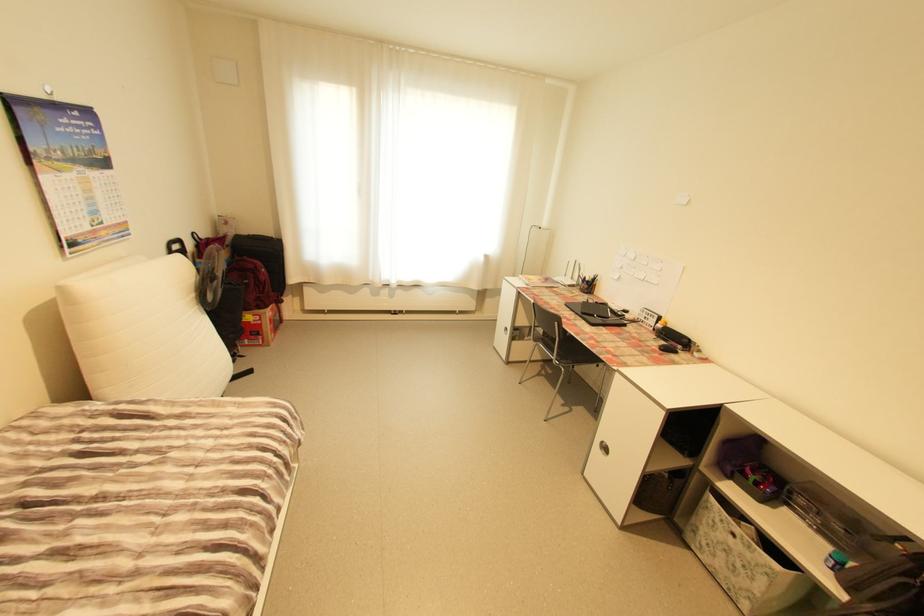
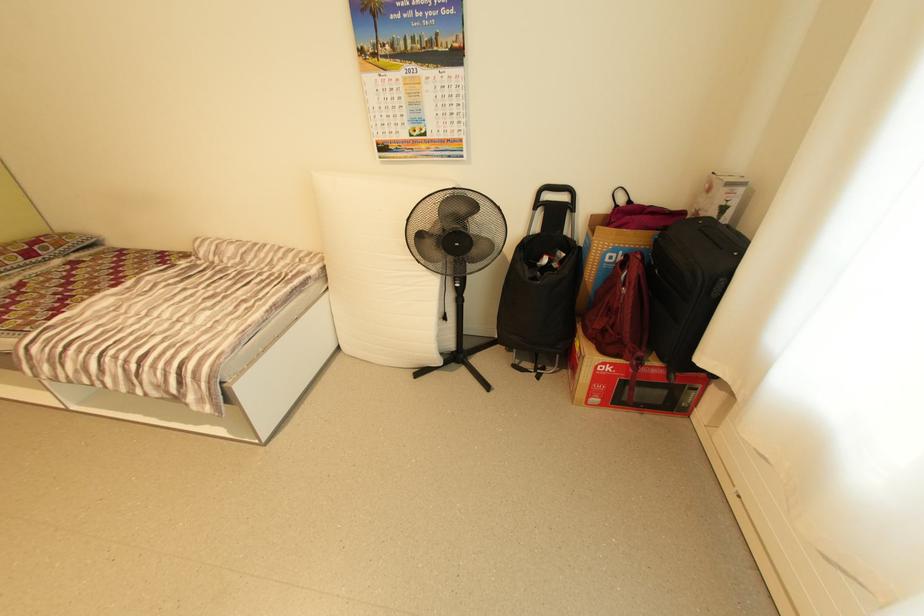
Question: I am providing you with two images of the same scene from different viewpoints. Which of the following objects are not visible in image2?

Choices:
 (A) red bag handle
 (B) fan control knob
 (C) microwave cardboard box
 (D) none of these

Answer: (D)